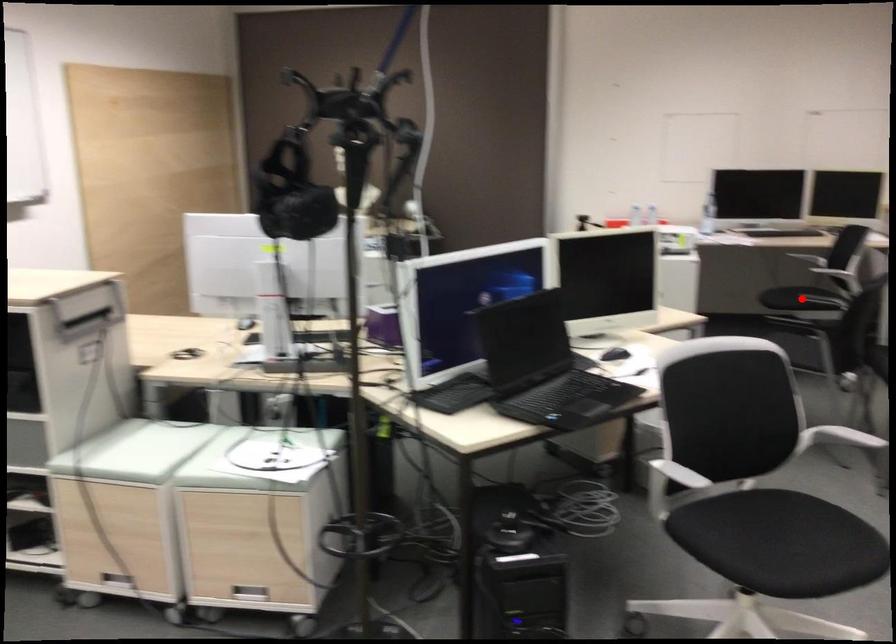
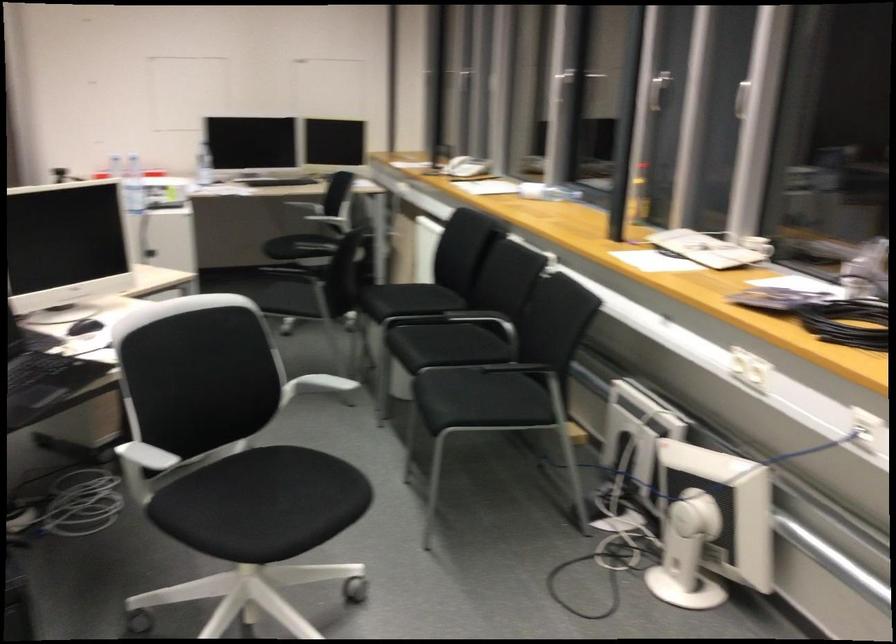
Question: I am providing you with two images of the same scene from different viewpoints. A red point is marked on the first image. At the location where the point appears in image 1, is it still visible in image 2?

Choices:
 (A) Yes
 (B) No

Answer: (A)